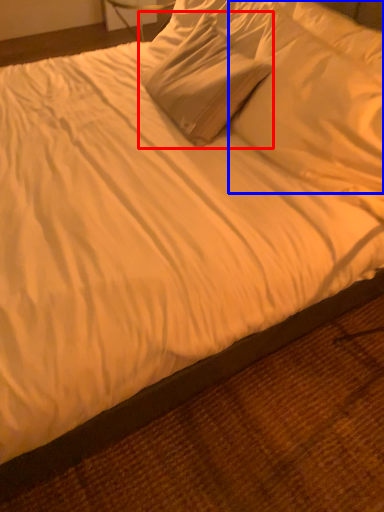
Question: Which object is closer to the camera taking this photo, pillow (highlighted by a red box) or pillow (highlighted by a blue box)?

Choices:
 (A) pillow
 (B) pillow

Answer: (B)